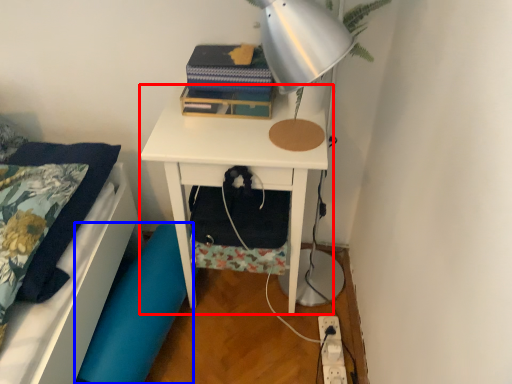
Question: Which object appears farthest to the camera in this image, nightstand (highlighted by a red box) or swivel chair (highlighted by a blue box)?

Choices:
 (A) nightstand
 (B) swivel chair

Answer: (B)